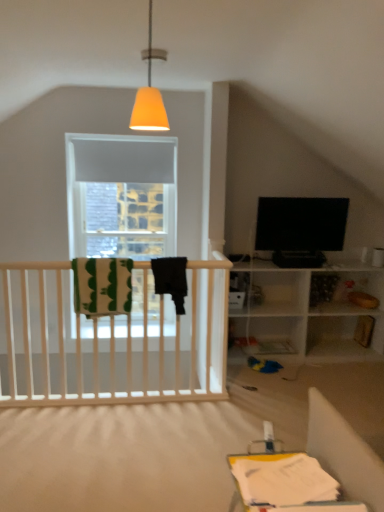
Question: Is matte orange cone at upper center at the right side of green striped blanket at left?

Choices:
 (A) no
 (B) yes

Answer: (B)

Question: From a real-world perspective, is matte orange cone at upper center located higher than green striped blanket at left?

Choices:
 (A) no
 (B) yes

Answer: (B)

Question: Does matte orange cone at upper center have a lesser height compared to green striped blanket at left?

Choices:
 (A) yes
 (B) no

Answer: (B)

Question: Is matte orange cone at upper center taller than green striped blanket at left?

Choices:
 (A) no
 (B) yes

Answer: (B)

Question: Does matte orange cone at upper center turn towards green striped blanket at left?

Choices:
 (A) yes
 (B) no

Answer: (B)

Question: Would you say matte orange cone at upper center contains green striped blanket at left?

Choices:
 (A) yes
 (B) no

Answer: (B)

Question: Is there a large distance between matte orange cone at upper center and black glossy tv at upper right?

Choices:
 (A) yes
 (B) no

Answer: (A)

Question: From the image's perspective, is matte orange cone at upper center over black glossy tv at upper right?

Choices:
 (A) no
 (B) yes

Answer: (B)

Question: Can you confirm if matte orange cone at upper center is thinner than black glossy tv at upper right?

Choices:
 (A) no
 (B) yes

Answer: (B)

Question: Is matte orange cone at upper center smaller than black glossy tv at upper right?

Choices:
 (A) yes
 (B) no

Answer: (A)

Question: From the image's perspective, does matte orange cone at upper center appear lower than black glossy tv at upper right?

Choices:
 (A) no
 (B) yes

Answer: (A)

Question: From a real-world perspective, is matte orange cone at upper center physically above black glossy tv at upper right?

Choices:
 (A) yes
 (B) no

Answer: (A)

Question: From a real-world perspective, is green striped blanket at left located higher than matte orange cone at upper center?

Choices:
 (A) yes
 (B) no

Answer: (B)